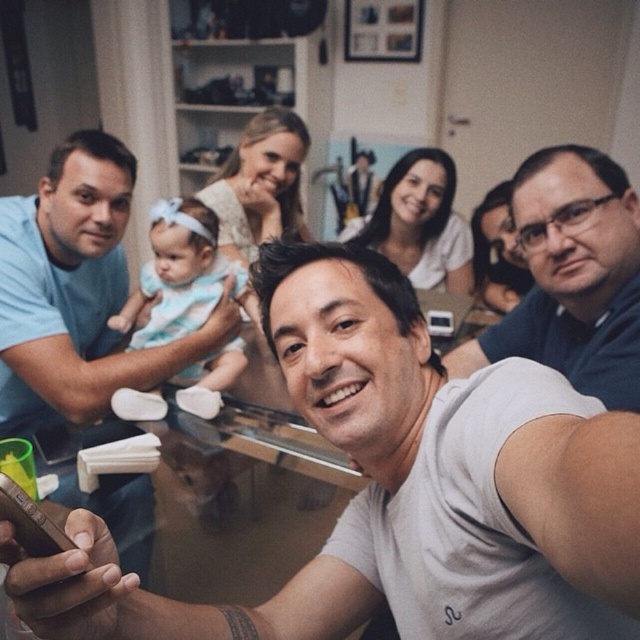
Does point (102, 413) come farther from viewer compared to point (621, 289)?

Yes, point (102, 413) is farther from viewer.

Identify the location of light blue fabric baby at left. The width and height of the screenshot is (640, 640). (77, 291).

Does light blue fabric baby at left have a lesser height compared to light blue fabric baby at center?

In fact, light blue fabric baby at left may be taller than light blue fabric baby at center.

Which is more to the right, light blue fabric baby at left or light blue fabric baby at center?

Positioned to the right is light blue fabric baby at center.

Is point (61, 388) positioned behind point (196, 381)?

That is False.

In order to click on light blue fabric baby at left in this screenshot , I will do `click(77, 291)`.

Between dark blue shirt at right and light blue fabric baby at center, which one is positioned higher?

light blue fabric baby at center

Locate an element on the screen. This screenshot has width=640, height=640. dark blue shirt at right is located at coordinates (572, 276).